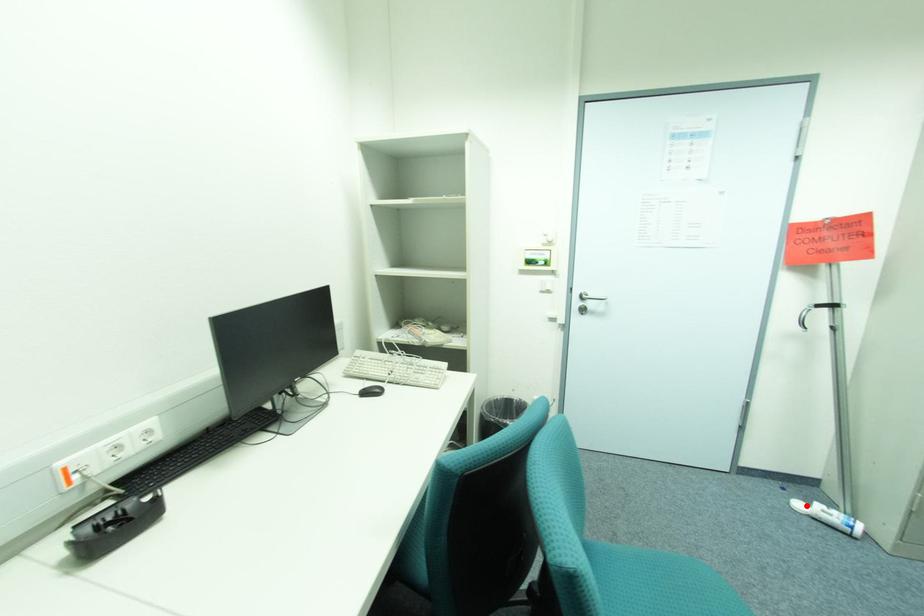
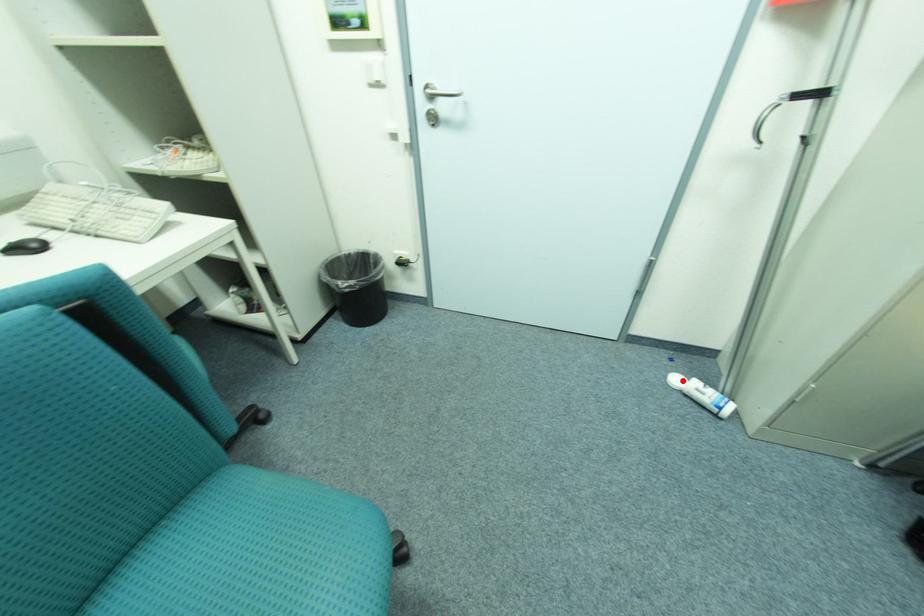
I am providing you with two images of the same scene from different viewpoints. A red point is marked on the first image and another point is marked on the second image. Are the points marked in image1 and image2 representing the same 3D position?

Yes